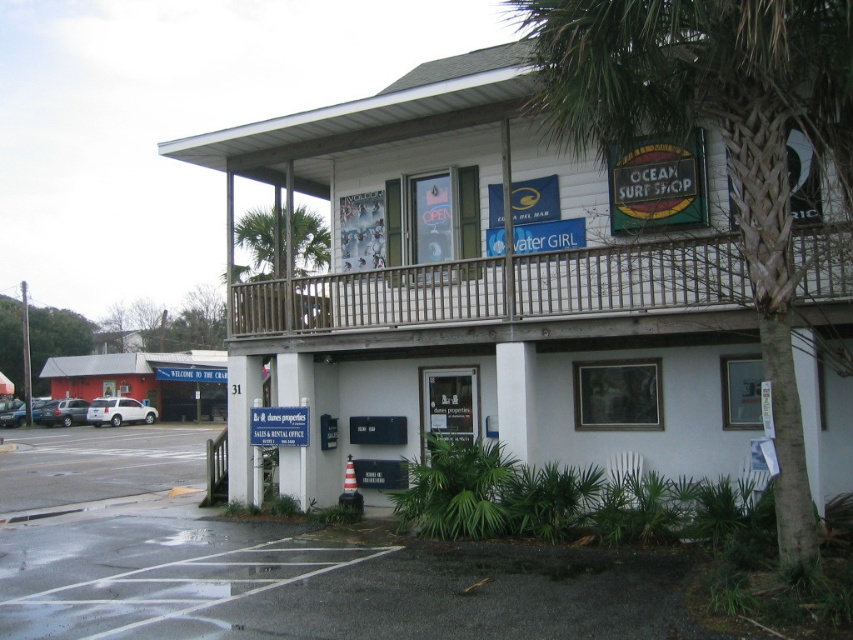
Question: Which is farther from the wooden at upper center?

Choices:
 (A) white plastic sign at center
 (B) green leafy palm tree at upper right
 (C) white wood building at center

Answer: (A)

Question: Can you confirm if green leafy palm tree at upper right is smaller than wooden at upper center?

Choices:
 (A) no
 (B) yes

Answer: (A)

Question: Can you confirm if gray asphalt parking lot at lower left is positioned below white plastic sign at center?

Choices:
 (A) yes
 (B) no

Answer: (A)

Question: Which point is farther to the camera?

Choices:
 (A) (354, 280)
 (B) (669, 189)
 (C) (440, 376)

Answer: (C)

Question: Which of the following is the closest to the observer?

Choices:
 (A) (281, 406)
 (B) (38, 502)
 (C) (648, 264)

Answer: (C)

Question: Is white wood building at center wider than gray asphalt parking lot at lower left?

Choices:
 (A) yes
 (B) no

Answer: (B)